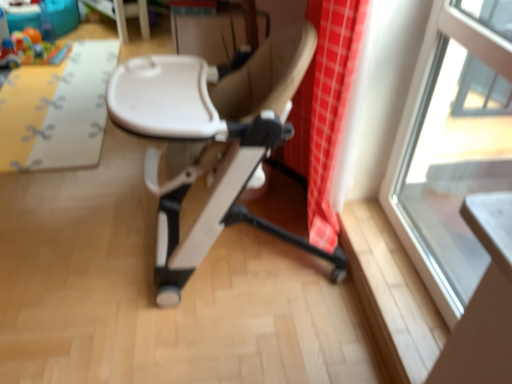
Question: Can you confirm if white glossy table at upper center is taller than beige leather chair at center?

Choices:
 (A) yes
 (B) no

Answer: (B)

Question: Does white glossy table at upper center have a smaller size compared to beige leather chair at center?

Choices:
 (A) no
 (B) yes

Answer: (B)

Question: Considering the relative positions of white glossy table at upper center and beige leather chair at center in the image provided, is white glossy table at upper center to the left of beige leather chair at center from the viewer's perspective?

Choices:
 (A) no
 (B) yes

Answer: (B)

Question: Is white glossy table at upper center next to beige leather chair at center?

Choices:
 (A) yes
 (B) no

Answer: (B)

Question: Is the position of white glossy table at upper center more distant than that of beige leather chair at center?

Choices:
 (A) yes
 (B) no

Answer: (A)

Question: From a real-world perspective, is yellow fabric mat at upper left physically located above or below transparent glass window at upper right?

Choices:
 (A) above
 (B) below

Answer: (B)

Question: From the image's perspective, is yellow fabric mat at upper left above or below transparent glass window at upper right?

Choices:
 (A) below
 (B) above

Answer: (B)

Question: Considering the relative positions of yellow fabric mat at upper left and transparent glass window at upper right in the image provided, is yellow fabric mat at upper left to the left or to the right of transparent glass window at upper right?

Choices:
 (A) right
 (B) left

Answer: (B)

Question: Which is correct: yellow fabric mat at upper left is inside transparent glass window at upper right, or outside of it?

Choices:
 (A) outside
 (B) inside

Answer: (A)

Question: Is rubberized plastic toy at upper left situated inside beige leather chair at center or outside?

Choices:
 (A) inside
 (B) outside

Answer: (B)

Question: Is point (51, 59) positioned closer to the camera than point (168, 223)?

Choices:
 (A) closer
 (B) farther

Answer: (B)

Question: Considering the positions of rubberized plastic toy at upper left and beige leather chair at center in the image, is rubberized plastic toy at upper left taller or shorter than beige leather chair at center?

Choices:
 (A) short
 (B) tall

Answer: (A)

Question: From a real-world perspective, relative to beige leather chair at center, is rubberized plastic toy at upper left vertically above or below?

Choices:
 (A) below
 (B) above

Answer: (A)

Question: In terms of width, does white glossy table at upper center look wider or thinner when compared to yellow fabric mat at upper left?

Choices:
 (A) thin
 (B) wide

Answer: (A)

Question: Is white glossy table at upper center in front of or behind yellow fabric mat at upper left in the image?

Choices:
 (A) behind
 (B) front

Answer: (A)